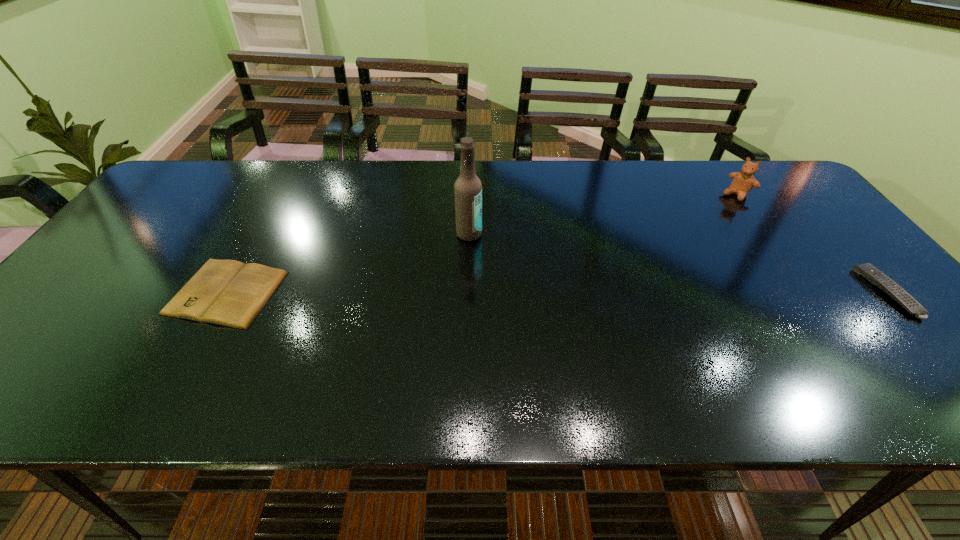
The width and height of the screenshot is (960, 540). I want to click on vacant space on the desktop that is between the leftmost object and the rightmost object and is positioned on the side of the third object from right to left with the label, so (524, 293).

You are a GUI agent. You are given a task and a screenshot of the screen. Output one action in this format:
    pyautogui.click(x=<x>, y=<y>)
    Task: Click on the vacant space on the desktop that is between the leftmost object and the remote control and is positioned on the face of the farthest object
    Image resolution: width=960 pixels, height=540 pixels.
    Given the screenshot: What is the action you would take?
    pyautogui.click(x=633, y=293)